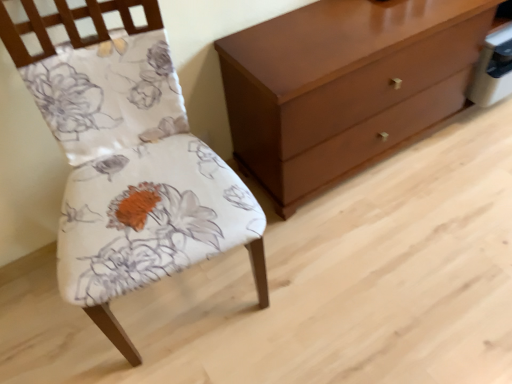
Question: From a real-world perspective, is floral fabric chair at left over matte brown chest of drawers at right?

Choices:
 (A) no
 (B) yes

Answer: (B)

Question: Is floral fabric chair at left to the left of matte brown chest of drawers at right from the viewer's perspective?

Choices:
 (A) no
 (B) yes

Answer: (B)

Question: Is floral fabric chair at left smaller than matte brown chest of drawers at right?

Choices:
 (A) no
 (B) yes

Answer: (B)

Question: Is floral fabric chair at left looking in the opposite direction of matte brown chest of drawers at right?

Choices:
 (A) no
 (B) yes

Answer: (A)

Question: Is the position of floral fabric chair at left more distant than that of matte brown chest of drawers at right?

Choices:
 (A) yes
 (B) no

Answer: (B)

Question: Does floral fabric chair at left have a lesser height compared to matte brown chest of drawers at right?

Choices:
 (A) no
 (B) yes

Answer: (A)

Question: Considering the relative sizes of matte brown chest of drawers at right and floral fabric chair at left in the image provided, is matte brown chest of drawers at right wider than floral fabric chair at left?

Choices:
 (A) yes
 (B) no

Answer: (B)

Question: Can you confirm if matte brown chest of drawers at right is shorter than floral fabric chair at left?

Choices:
 (A) no
 (B) yes

Answer: (B)

Question: Is matte brown chest of drawers at right to the left of floral fabric chair at left from the viewer's perspective?

Choices:
 (A) no
 (B) yes

Answer: (A)

Question: Can we say matte brown chest of drawers at right lies outside floral fabric chair at left?

Choices:
 (A) no
 (B) yes

Answer: (B)

Question: Can you confirm if matte brown chest of drawers at right is bigger than floral fabric chair at left?

Choices:
 (A) yes
 (B) no

Answer: (A)

Question: Is matte brown chest of drawers at right taller than floral fabric chair at left?

Choices:
 (A) yes
 (B) no

Answer: (B)

Question: Is matte brown chest of drawers at right spatially inside floral fabric chair at left, or outside of it?

Choices:
 (A) outside
 (B) inside

Answer: (A)